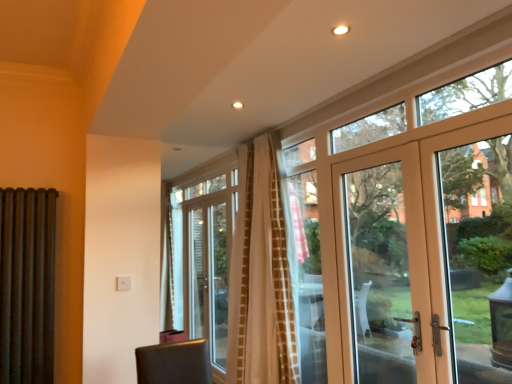
Question: Are clear glass door at upper right and white textured curtain at center far apart?

Choices:
 (A) no
 (B) yes

Answer: (B)

Question: Does clear glass door at upper right have a smaller size compared to white textured curtain at center?

Choices:
 (A) yes
 (B) no

Answer: (A)

Question: Is white textured curtain at center inside clear glass door at upper right?

Choices:
 (A) no
 (B) yes

Answer: (A)

Question: Can we say clear glass door at upper right lies outside white textured curtain at center?

Choices:
 (A) yes
 (B) no

Answer: (A)

Question: Does clear glass door at upper right have a greater height compared to white textured curtain at center?

Choices:
 (A) no
 (B) yes

Answer: (A)

Question: Considering the relative sizes of clear glass door at upper right and white textured curtain at center in the image provided, is clear glass door at upper right thinner than white textured curtain at center?

Choices:
 (A) yes
 (B) no

Answer: (A)

Question: Considering the relative sizes of matte white door at right and white textured curtain at center in the image provided, is matte white door at right wider than white textured curtain at center?

Choices:
 (A) no
 (B) yes

Answer: (A)

Question: Is matte white door at right shorter than white textured curtain at center?

Choices:
 (A) no
 (B) yes

Answer: (B)

Question: Would you say matte white door at right is a long distance from white textured curtain at center?

Choices:
 (A) no
 (B) yes

Answer: (A)

Question: Is matte white door at right with white textured curtain at center?

Choices:
 (A) no
 (B) yes

Answer: (A)

Question: From the image's perspective, is matte white door at right above white textured curtain at center?

Choices:
 (A) yes
 (B) no

Answer: (A)

Question: Is matte white door at right positioned in front of white textured curtain at center?

Choices:
 (A) yes
 (B) no

Answer: (A)

Question: From the image's perspective, is rusty metal radiator at left above white textured curtain at center?

Choices:
 (A) no
 (B) yes

Answer: (A)